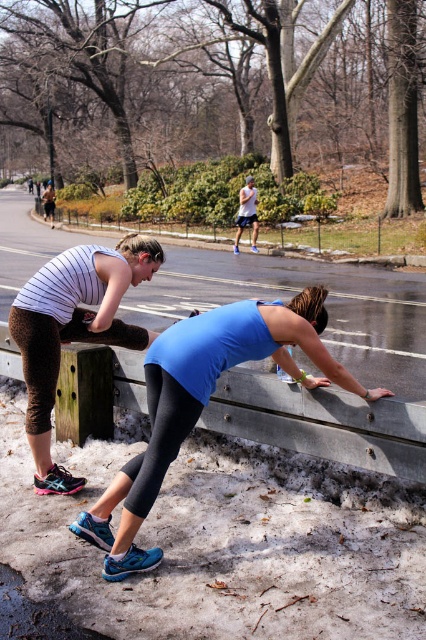
Question: Which of the following is the farthest from the observer?

Choices:
 (A) matte black tank top at left
 (B) blue matte tank top at center

Answer: (A)

Question: Does blue matte tank top at center lie behind matte black tank top at left?

Choices:
 (A) no
 (B) yes

Answer: (A)

Question: Considering the relative positions of blue matte tank top at center and matte black tank top at left in the image provided, where is blue matte tank top at center located with respect to matte black tank top at left?

Choices:
 (A) above
 (B) below

Answer: (B)

Question: From the image, what is the correct spatial relationship of blue matte tank top at center in relation to matte black tank top at left?

Choices:
 (A) above
 (B) below

Answer: (B)

Question: Which object is closer to the camera taking this photo?

Choices:
 (A) matte black tank top at left
 (B) blue matte tank top at center

Answer: (B)